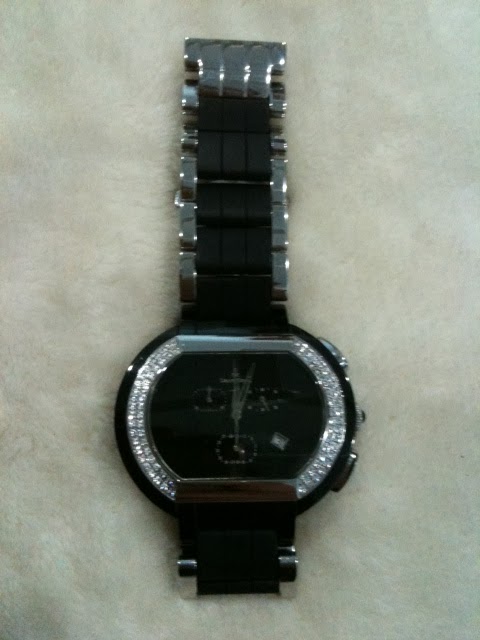
Locate an element on the screen. This screenshot has width=480, height=640. knob is located at coordinates (361, 416).